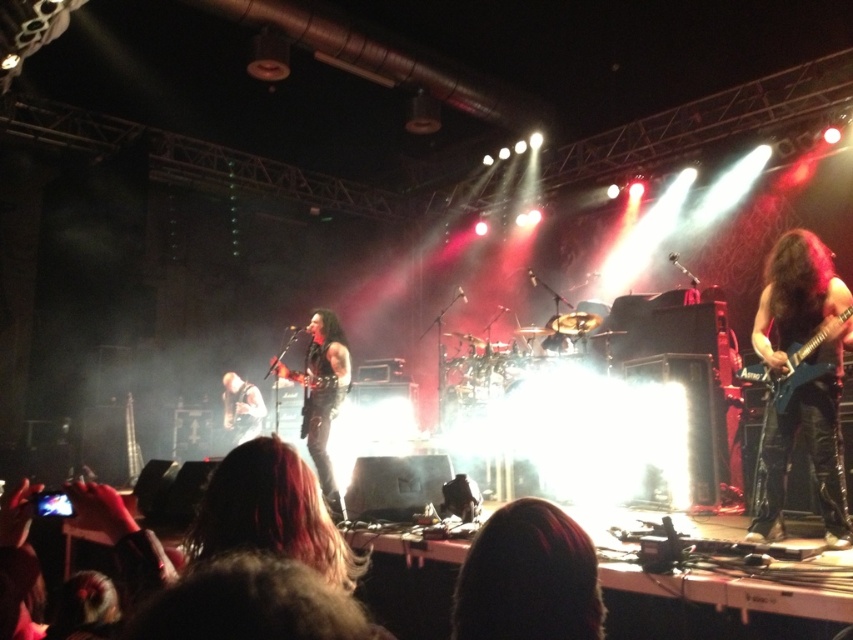
You are a stagehand who needs to place a 1.2 meter wide amplifier between the shiny black guitar at center and the shiny black electric guitar at center. Can the amplifier fit between them?

The shiny black guitar at center has a lesser width compared to shiny black electric guitar at center, but the distance between them isn not provided. Without knowing the space between the guitars, it is impossible to determine if the amplifier will fit.

You are a photographer at the back of the venue. You want to take a photo of the shiny black electric guitar at right without the black leather jacket at center blocking it. Is this possible given their positions?

The shiny black electric guitar at right is behind the black leather jacket at center, so it is blocked and you cannot take a clear photo of it without the jacket obstructing the view.

You are a photographer standing at the back of the venue. You want to take a clear photo of the black leather jacket at center without any blur. The camera you have has a focus range of 4 meters to 5 meters. Can you capture the jacket clearly?

The black leather jacket at center is 4.52 meters away from the viewer. Since the camera can focus between 4 meters and 5 meters, the jacket is within the focus range, so you can capture it clearly.